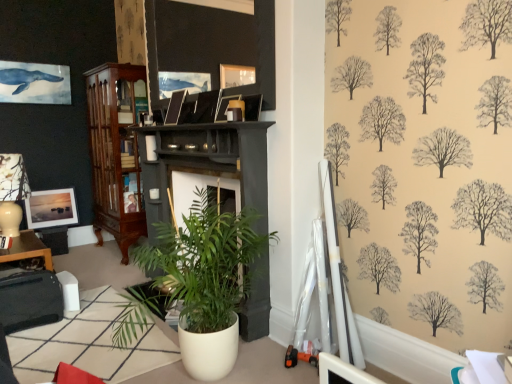
You are a GUI agent. You are given a task and a screenshot of the screen. Output one action in this format:
    pyautogui.click(x=<x>, y=<y>)
    Task: Click on the white glossy pot at center
    This screenshot has height=384, width=512.
    Given the screenshot: What is the action you would take?
    pyautogui.click(x=197, y=284)

The image size is (512, 384). Find the location of `matte brown picture frame at upper center, which is the 1th picture frame in right-to-left order`. matte brown picture frame at upper center, which is the 1th picture frame in right-to-left order is located at coordinates (224, 107).

The width and height of the screenshot is (512, 384). Describe the element at coordinates (51, 208) in the screenshot. I see `matte white picture frame at lower left, which is the 1th picture frame from bottom to top` at that location.

What is the approximate width of matte white picture frame at lower left, acting as the first picture frame starting from the left?

matte white picture frame at lower left, acting as the first picture frame starting from the left, is 4.41 inches in width.

Locate an element on the screen. matte black lampshade at left is located at coordinates (12, 192).

Is mahogany wood cabinet at left bigger than matte brown picture frame at upper center, the 2th picture frame when ordered from front to back?

Yes, mahogany wood cabinet at left is bigger than matte brown picture frame at upper center, the 2th picture frame when ordered from front to back.

Which is closer to the camera, (89,95) or (239,96)?

Positioned in front is point (239,96).

Would you say mahogany wood cabinet at left is inside or outside matte brown picture frame at upper center, which is the 1th picture frame in right-to-left order?

The correct answer is: outside.

What's the angular difference between mahogany wood cabinet at left and matte brown picture frame at upper center, marked as the 2th picture frame in a bottom-to-top arrangement,'s facing directions?

The angle between the facing direction of mahogany wood cabinet at left and the facing direction of matte brown picture frame at upper center, marked as the 2th picture frame in a bottom-to-top arrangement, is 3.75 degrees.

From a real-world perspective, is matte black lampshade at left positioned above or below white glossy pot at center?

From a real-world perspective, matte black lampshade at left is physically above white glossy pot at center.

Choose the correct answer: Is matte black lampshade at left inside white glossy pot at center or outside it?

matte black lampshade at left is outside white glossy pot at center.

From the image's perspective, would you say matte black lampshade at left is shown under white glossy pot at center?

Incorrect, from the image's perspective, matte black lampshade at left is higher than white glossy pot at center.

Considering the positions of objects white glossy pot at center and white glossy table at lower left, which is the 1th table from bottom to top, in the image provided, who is more to the right, white glossy pot at center or white glossy table at lower left, which is the 1th table from bottom to top,?

white glossy pot at center.

At what (x,y) coordinates should I click in order to perform the action: click on the 2nd table positioned below the white glossy pot at center (from a real-world perspective). Please return your answer as a coordinate pair (x, y). This screenshot has width=512, height=384. Looking at the image, I should click on (89, 344).

How much distance is there between white glossy pot at center and white glossy table at lower left, which is the second table from back to front?

white glossy pot at center is 26.71 inches from white glossy table at lower left, which is the second table from back to front.

What's the angular difference between white glossy pot at center and white glossy table at lower left, placed as the 2th table when sorted from left to right,'s facing directions?

The angular difference between white glossy pot at center and white glossy table at lower left, placed as the 2th table when sorted from left to right, is 2.17 degrees.

What's the angular difference between matte brown picture frame at upper center, the third picture frame when ordered from left to right, and white glossy table at lower left, arranged as the 2th table when viewed from the right,'s facing directions?

86.3 degrees.

Does point (234, 95) lie behind point (67, 231)?

That is False.

Does matte brown picture frame at upper center, the third picture frame when ordered from left to right, have a lesser width compared to white glossy table at lower left, which is counted as the first table, starting from the left?

Indeed, matte brown picture frame at upper center, the third picture frame when ordered from left to right, has a lesser width compared to white glossy table at lower left, which is counted as the first table, starting from the left.

Is matte brown picture frame at upper center, arranged as the second picture frame when viewed from the top, far from white glossy table at lower left, the second table ordered from the bottom?

Indeed, matte brown picture frame at upper center, arranged as the second picture frame when viewed from the top, is not near white glossy table at lower left, the second table ordered from the bottom.

Is white glossy table at lower left, which is the second table from back to front, looking in the opposite direction of matte white picture frame at lower left, which is the 1th picture frame from bottom to top?

That's not correct — white glossy table at lower left, which is the second table from back to front, is not looking away from matte white picture frame at lower left, which is the 1th picture frame from bottom to top.

From the image's perspective, between white glossy table at lower left, which is the second table from back to front, and matte white picture frame at lower left, the third picture frame from the front, which one is located above?

From the image's view, matte white picture frame at lower left, the third picture frame from the front, is above.

Could matte white picture frame at lower left, the third picture frame from the front, be considered to be inside white glossy table at lower left, which appears as the 1th table when viewed from the right?

No, matte white picture frame at lower left, the third picture frame from the front, is not inside white glossy table at lower left, which appears as the 1th table when viewed from the right.

Which point is more distant from viewer, (73,349) or (56,215)?

Point (56,215)

Is matte white picture frame at lower left, the third picture frame from the front, thinner than white glossy table at lower left, which is the 1th table from bottom to top?

Correct, the width of matte white picture frame at lower left, the third picture frame from the front, is less than that of white glossy table at lower left, which is the 1th table from bottom to top.

The width and height of the screenshot is (512, 384). Identify the location of picture frame that is the 3rd object located behind the white glossy table at lower left, which is the second table from back to front. (51, 208).

Considering the sizes of matte white picture frame at lower left, acting as the first picture frame starting from the left, and white glossy table at lower left, which is the 1th table from bottom to top, in the image, is matte white picture frame at lower left, acting as the first picture frame starting from the left, bigger or smaller than white glossy table at lower left, which is the 1th table from bottom to top,?

Considering their sizes, matte white picture frame at lower left, acting as the first picture frame starting from the left, takes up less space than white glossy table at lower left, which is the 1th table from bottom to top.

Would you say matte white picture frame at lower left, which is the 1th picture frame in back-to-front order, is inside or outside matte brown picture frame at upper center, the 2th picture frame when ordered from front to back?

matte white picture frame at lower left, which is the 1th picture frame in back-to-front order, is outside matte brown picture frame at upper center, the 2th picture frame when ordered from front to back.

Is matte white picture frame at lower left, the third picture frame from the front, smaller than matte brown picture frame at upper center, which is the 1th picture frame in right-to-left order?

Actually, matte white picture frame at lower left, the third picture frame from the front, might be larger than matte brown picture frame at upper center, which is the 1th picture frame in right-to-left order.

Between matte white picture frame at lower left, acting as the third picture frame starting from the top, and matte brown picture frame at upper center, the third picture frame when ordered from left to right, which one has more height?

Standing taller between the two is matte white picture frame at lower left, acting as the third picture frame starting from the top.

From a real-world perspective, count 1st picture frames upward from the mahogany wood cabinet at left and point to it. Please provide its 2D coordinates.

[(224, 107)]

In order to click on lamp that is on the left side of white glossy pot at center in this screenshot , I will do `click(12, 192)`.

In the scene shown: Based on their spatial positions, is matte brown picture frame at upper center, the 2th picture frame when ordered from front to back, or white glossy table at lower left, which is counted as the first table, starting from the left, further from matte black lampshade at left?

The object further to matte black lampshade at left is matte brown picture frame at upper center, the 2th picture frame when ordered from front to back.

Estimate the real-world distances between objects in this image. Which object is further from wooden picture frame at upper center, the first picture frame in the top-to-bottom sequence, matte white picture frame at lower left, which is the 1th picture frame in back-to-front order, or matte brown picture frame at upper center, arranged as the second picture frame when viewed from the top?

Among the two, matte white picture frame at lower left, which is the 1th picture frame in back-to-front order, is located further to wooden picture frame at upper center, the first picture frame in the top-to-bottom sequence.

Which object lies further to the anchor point mahogany wood cabinet at left, matte black lampshade at left or white glossy table at lower left, which is the second table from back to front?

white glossy table at lower left, which is the second table from back to front, is further to mahogany wood cabinet at left.

Estimate the real-world distances between objects in this image. Which object is closer to white glossy table at lower left, placed as the 2th table when sorted from left to right, mahogany wood cabinet at left or wooden picture frame at upper center, the first picture frame in the top-to-bottom sequence?

mahogany wood cabinet at left is positioned closer to the anchor white glossy table at lower left, placed as the 2th table when sorted from left to right.

Estimate the real-world distances between objects in this image. Which object is further from matte black lampshade at left, white glossy pot at center or matte white picture frame at lower left, acting as the first picture frame starting from the left?

white glossy pot at center is positioned further to the anchor matte black lampshade at left.

Estimate the real-world distances between objects in this image. Which object is further from white glossy table at lower left, which ranks as the 2th table in front-to-back order, matte black lampshade at left or white glossy pot at center?

The object further to white glossy table at lower left, which ranks as the 2th table in front-to-back order, is white glossy pot at center.

Based on their spatial positions, is white glossy pot at center or mahogany wood cabinet at left closer to white glossy table at lower left, acting as the 1th table starting from the front?

white glossy pot at center lies closer to white glossy table at lower left, acting as the 1th table starting from the front, than the other object.

Which object lies nearer to the anchor point mahogany wood cabinet at left, matte black lampshade at left or matte white picture frame at lower left, arranged as the 3th picture frame when viewed from the right?

The object closer to mahogany wood cabinet at left is matte white picture frame at lower left, arranged as the 3th picture frame when viewed from the right.

The height and width of the screenshot is (384, 512). What are the coordinates of `cabinetry located between matte black lampshade at left and white glossy table at lower left, which ranks as the 2th table in front-to-back order, in the depth direction` in the screenshot? It's located at (115, 153).

The height and width of the screenshot is (384, 512). I want to click on cabinetry between wooden picture frame at upper center, the first picture frame in the top-to-bottom sequence, and white glossy table at lower left, arranged as the first table when viewed from the top, from front to back, so click(115, 153).

Find the location of a particular element. The image size is (512, 384). picture frame between matte black lampshade at left and matte brown picture frame at upper center, marked as the 2th picture frame in a bottom-to-top arrangement is located at coordinates (210, 43).

I want to click on lamp located between white glossy pot at center and matte white picture frame at lower left, acting as the third picture frame starting from the top, in the depth direction, so click(12, 192).